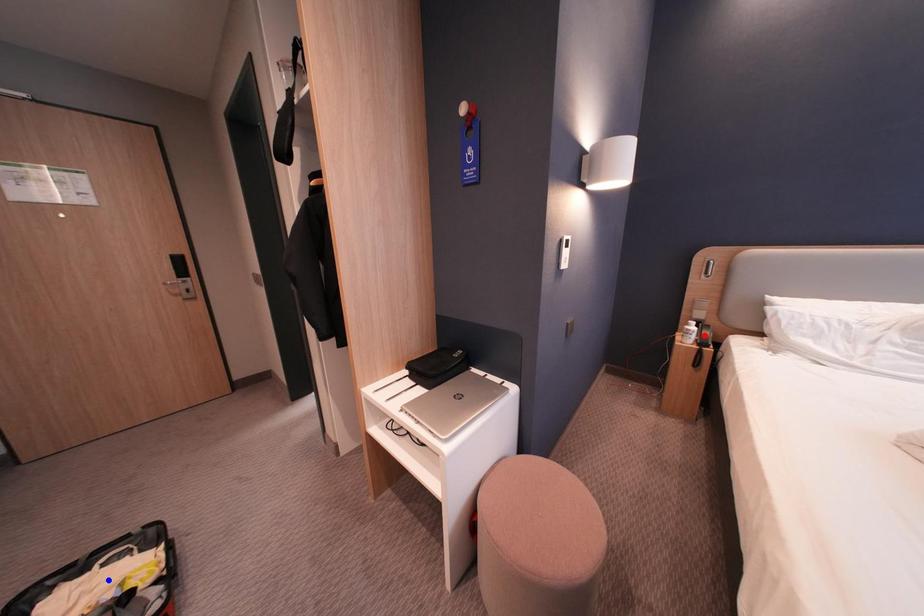
Question: Two points are marked on the image. Which point is closer to the camera?

Choices:
 (A) Blue point is closer.
 (B) Red point is closer.

Answer: (A)